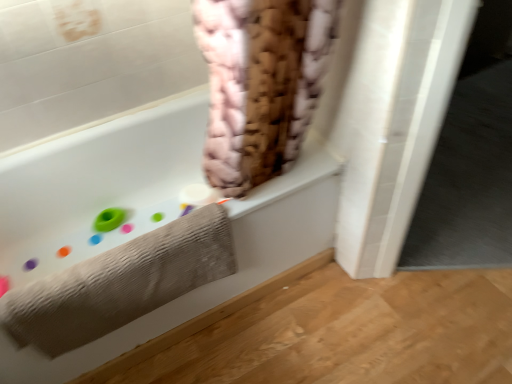
I want to click on white matte bathtub at upper left, so click(97, 184).

In order to click on white matte bathtub at upper left in this screenshot , I will do `click(97, 184)`.

Locate an element on the screen. This screenshot has width=512, height=384. towel on the left of white matte toilet paper at upper center is located at coordinates (120, 283).

From a real-world perspective, relative to white matte toilet paper at upper center, is gray textured towel at lower left vertically above or below?

gray textured towel at lower left is situated higher than white matte toilet paper at upper center in the real world.

Is white matte toilet paper at upper center located within gray textured towel at lower left?

No.

How much distance is there between gray textured towel at lower left and white matte toilet paper at upper center?

The distance of gray textured towel at lower left from white matte toilet paper at upper center is 59.86 centimeters.

Locate an element on the screen. The image size is (512, 384). toilet paper to the right of white matte bathtub at upper left is located at coordinates (198, 195).

Does white matte bathtub at upper left turn towards white matte toilet paper at upper center?

Yes, white matte bathtub at upper left is turned towards white matte toilet paper at upper center.

Between white matte bathtub at upper left and white matte toilet paper at upper center, which one appears on the right side from the viewer's perspective?

From the viewer's perspective, white matte toilet paper at upper center appears more on the right side.

Could you tell me if white matte bathtub at upper left is facing gray textured towel at lower left?

Yes, white matte bathtub at upper left is oriented towards gray textured towel at lower left.

Can you tell me how much white matte bathtub at upper left and gray textured towel at lower left differ in facing direction?

4.84e-05 degrees separate the facing orientations of white matte bathtub at upper left and gray textured towel at lower left.

Can you confirm if white matte bathtub at upper left is wider than gray textured towel at lower left?

Yes, white matte bathtub at upper left is wider than gray textured towel at lower left.

Between white matte bathtub at upper left and gray textured towel at lower left, which one has less height?

gray textured towel at lower left is shorter.

Does point (184, 195) come in front of point (103, 147)?

No, (184, 195) is further to viewer.

Which of these two, white matte toilet paper at upper center or white matte bathtub at upper left, is bigger?

white matte bathtub at upper left is bigger.

Is white matte toilet paper at upper center positioned behind white matte bathtub at upper left?

Yes, white matte toilet paper at upper center is further from the camera.

Is gray textured towel at lower left situated inside white matte bathtub at upper left or outside?

gray textured towel at lower left is located inside white matte bathtub at upper left.

From a real-world perspective, between gray textured towel at lower left and white matte bathtub at upper left, who is vertically lower?

white matte bathtub at upper left.

Where is `towel above the white matte bathtub at upper left (from a real-world perspective)`? towel above the white matte bathtub at upper left (from a real-world perspective) is located at coordinates (120, 283).

Measure the distance between gray textured towel at lower left and white matte bathtub at upper left.

The distance of gray textured towel at lower left from white matte bathtub at upper left is 21.03 inches.

Is white matte toilet paper at upper center bigger than gray textured towel at lower left?

Incorrect, white matte toilet paper at upper center is not larger than gray textured towel at lower left.

Would you say white matte toilet paper at upper center is a long distance from gray textured towel at lower left?

No, white matte toilet paper at upper center is not far away from gray textured towel at lower left.

I want to click on toilet paper below the gray textured towel at lower left (from a real-world perspective), so click(x=198, y=195).

Would you say white matte toilet paper at upper center is outside gray textured towel at lower left?

Absolutely, white matte toilet paper at upper center is external to gray textured towel at lower left.

Locate an element on the screen. toilet paper on the right side of gray textured towel at lower left is located at coordinates (198, 195).

Where is `toilet paper above the white matte bathtub at upper left (from the image's perspective)`? This screenshot has height=384, width=512. toilet paper above the white matte bathtub at upper left (from the image's perspective) is located at coordinates (198, 195).

Looking at the image, which one is located further to white matte toilet paper at upper center, gray textured towel at lower left or white matte bathtub at upper left?

The object further to white matte toilet paper at upper center is gray textured towel at lower left.

Estimate the real-world distances between objects in this image. Which object is closer to gray textured towel at lower left, white matte toilet paper at upper center or white matte bathtub at upper left?

white matte bathtub at upper left.

Considering their positions, is white matte bathtub at upper left positioned further to gray textured towel at lower left than white matte toilet paper at upper center?

Among the two, white matte toilet paper at upper center is located further to gray textured towel at lower left.

Considering their positions, is white matte toilet paper at upper center positioned further to white matte bathtub at upper left than gray textured towel at lower left?

gray textured towel at lower left is positioned further to the anchor white matte bathtub at upper left.

Based on their spatial positions, is gray textured towel at lower left or white matte toilet paper at upper center closer to white matte bathtub at upper left?

white matte toilet paper at upper center.

Based on the photo, looking at the image, which one is located further to white matte toilet paper at upper center, white matte bathtub at upper left or gray textured towel at lower left?

Among the two, gray textured towel at lower left is located further to white matte toilet paper at upper center.

The width and height of the screenshot is (512, 384). In order to click on towel between white matte bathtub at upper left and white matte toilet paper at upper center along the z-axis in this screenshot , I will do `click(120, 283)`.